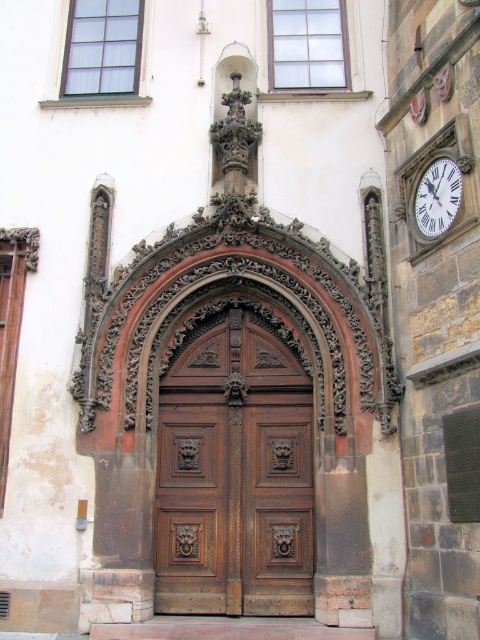
Between polished wood door at center and white glossy clock at upper right, which one is positioned lower?

polished wood door at center

Find the location of a particular element. The width and height of the screenshot is (480, 640). polished wood door at center is located at coordinates (235, 474).